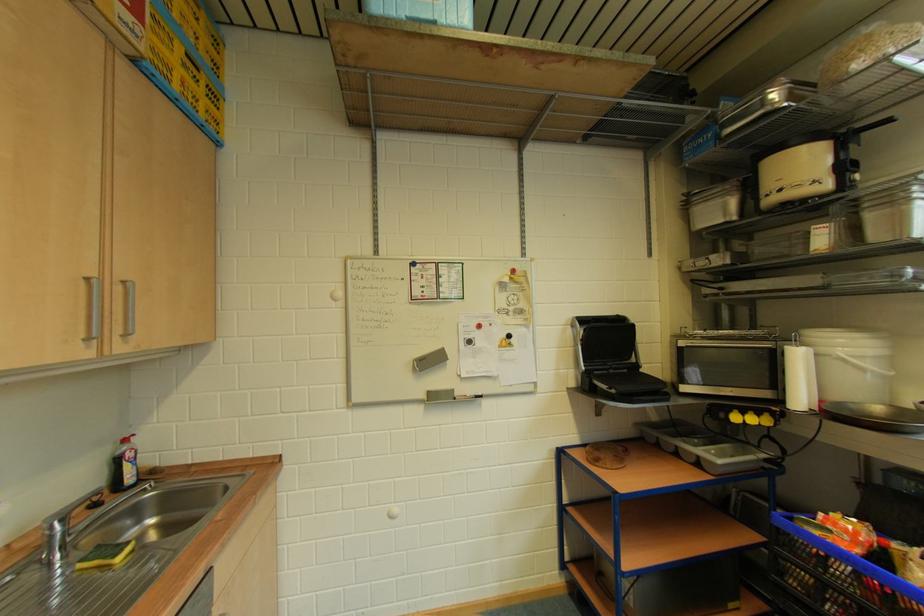
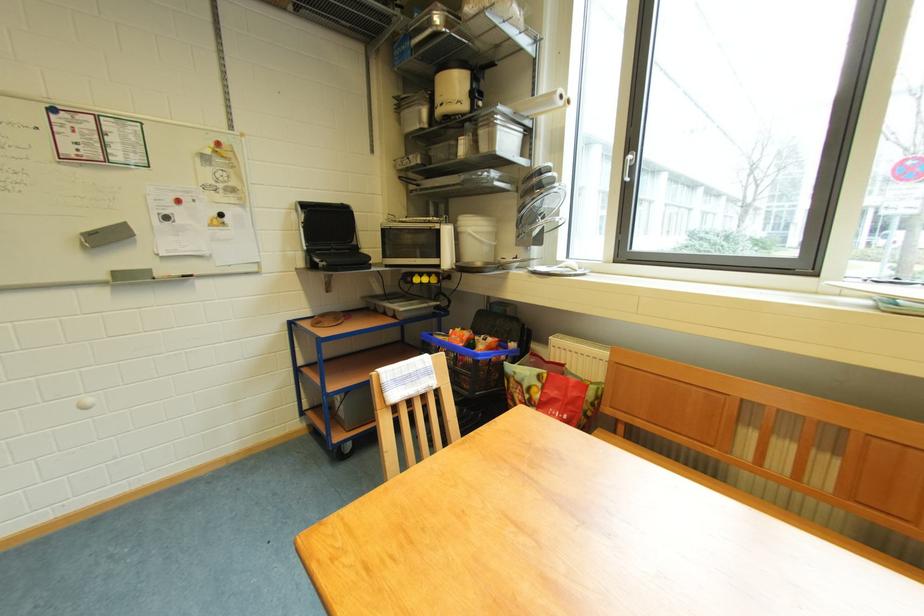
Locate, in the second image, the point that corresponds to point 424,371 in the first image.

(95, 248)